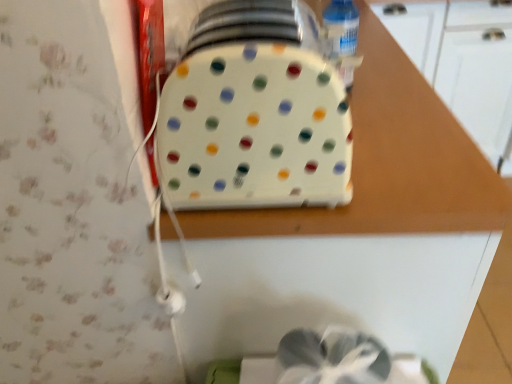
Question: Is white plastic tray at center oriented towards clear plastic bottle at upper right?

Choices:
 (A) yes
 (B) no

Answer: (B)

Question: Is clear plastic bottle at upper right located within white plastic tray at center?

Choices:
 (A) yes
 (B) no

Answer: (B)

Question: Is white plastic tray at center bigger than clear plastic bottle at upper right?

Choices:
 (A) yes
 (B) no

Answer: (A)

Question: From a real-world perspective, is white plastic tray at center on clear plastic bottle at upper right?

Choices:
 (A) no
 (B) yes

Answer: (A)

Question: From the image's perspective, is white plastic tray at center on top of clear plastic bottle at upper right?

Choices:
 (A) yes
 (B) no

Answer: (B)

Question: Is white plastic tray at center not near clear plastic bottle at upper right?

Choices:
 (A) no
 (B) yes

Answer: (A)

Question: Can you confirm if white plastic tray at center is taller than white plastic toaster at center?

Choices:
 (A) no
 (B) yes

Answer: (B)

Question: Does white plastic tray at center appear on the left side of white plastic toaster at center?

Choices:
 (A) yes
 (B) no

Answer: (B)

Question: Can you confirm if white plastic tray at center is positioned to the right of white plastic toaster at center?

Choices:
 (A) no
 (B) yes

Answer: (B)

Question: Is white plastic tray at center thinner than white plastic toaster at center?

Choices:
 (A) yes
 (B) no

Answer: (B)

Question: From the image's perspective, is white plastic tray at center above white plastic toaster at center?

Choices:
 (A) no
 (B) yes

Answer: (A)

Question: Does white plastic tray at center come in front of white plastic toaster at center?

Choices:
 (A) yes
 (B) no

Answer: (B)

Question: Are clear plastic bottle at upper right and white plastic tray at center beside each other?

Choices:
 (A) no
 (B) yes

Answer: (A)